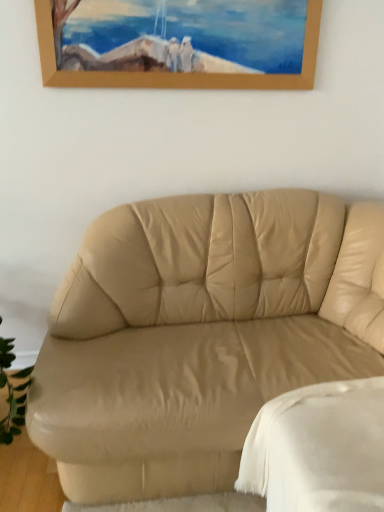
This screenshot has width=384, height=512. In order to click on white soft fabric at lower right in this screenshot , I will do `click(318, 448)`.

What is the approximate height of white soft fabric at lower right?

white soft fabric at lower right is 14.74 inches tall.

What do you see at coordinates (318, 448) in the screenshot? I see `white soft fabric at lower right` at bounding box center [318, 448].

In order to click on white soft fabric at lower right in this screenshot , I will do `click(318, 448)`.